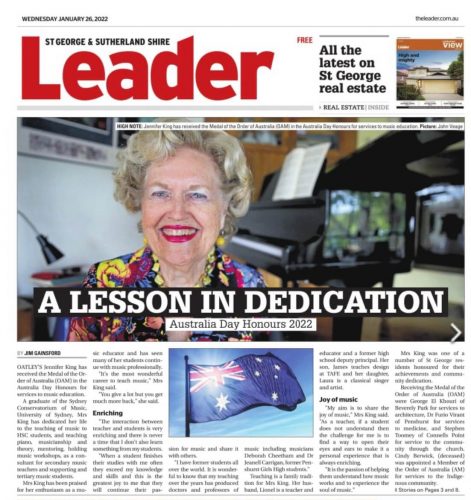
In order to click on piano leg in this screenshot , I will do `click(350, 329)`.